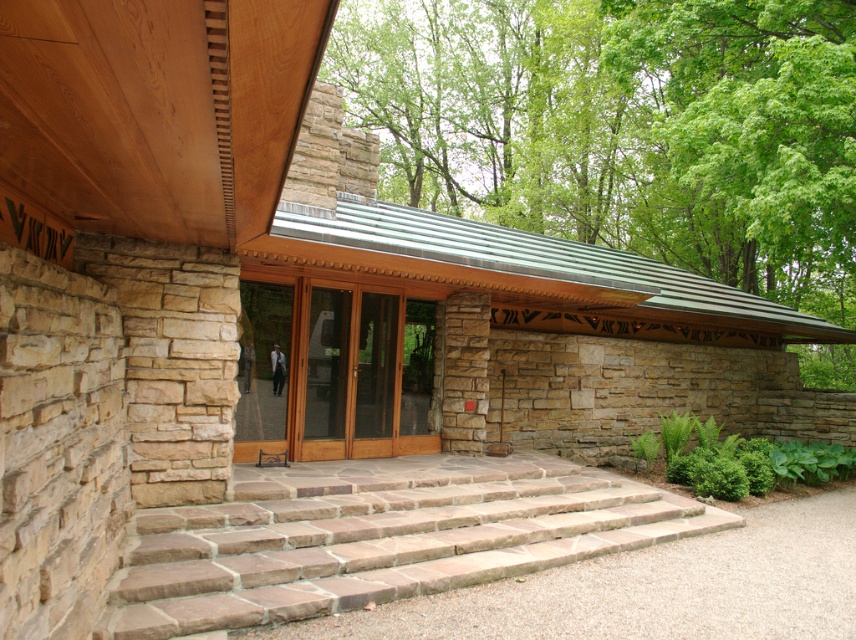
Question: Does green leafy tree at upper center appear under wooden glass doors at center?

Choices:
 (A) no
 (B) yes

Answer: (A)

Question: Can you confirm if green leafy tree at upper center is positioned to the right of wooden glass doors at center?

Choices:
 (A) yes
 (B) no

Answer: (A)

Question: Which point is farther to the camera?

Choices:
 (A) wooden glass doors at center
 (B) brown stone stairs at center
 (C) green leafy tree at upper center

Answer: (C)

Question: Which is nearer to the wooden glass doors at center?

Choices:
 (A) brown stone stairs at center
 (B) green leafy tree at upper center

Answer: (A)

Question: Which of the following is the closest to the observer?

Choices:
 (A) (259, 481)
 (B) (486, 170)

Answer: (A)

Question: Is green leafy tree at upper center to the right of wooden glass doors at center from the viewer's perspective?

Choices:
 (A) yes
 (B) no

Answer: (A)